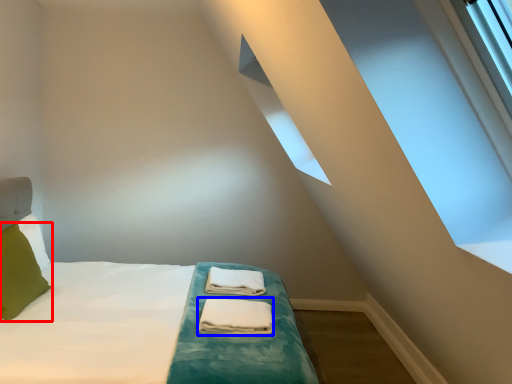
Question: Which object appears farthest to the camera in this image, pillow (highlighted by a red box) or material (highlighted by a blue box)?

Choices:
 (A) pillow
 (B) material

Answer: (B)